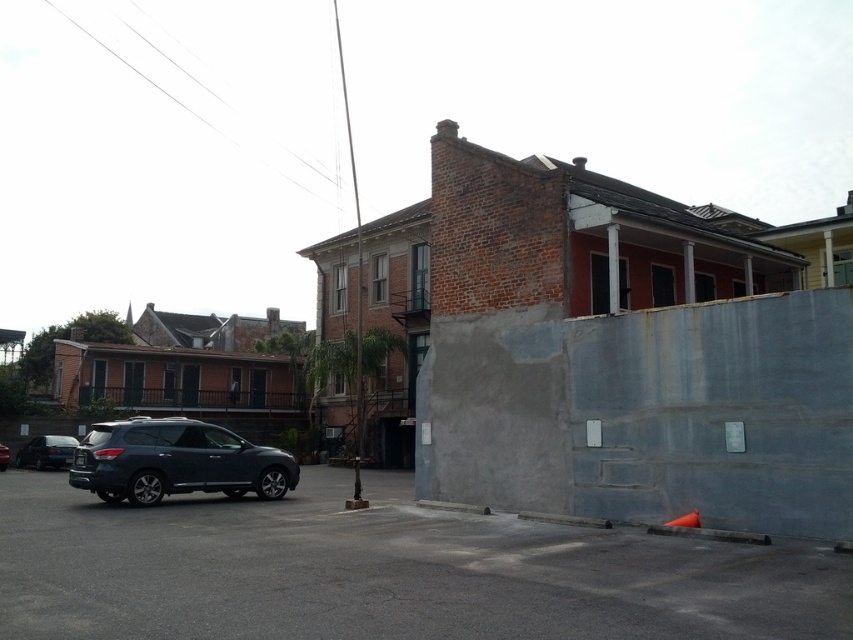
Looking at this image, does satin black suv at lower left have a smaller size compared to satin black sedan at lower left?

No, satin black suv at lower left is not smaller than satin black sedan at lower left.

At what (x,y) coordinates should I click in order to perform the action: click on satin black suv at lower left. Please return your answer as a coordinate pair (x, y). The height and width of the screenshot is (640, 853). Looking at the image, I should click on (177, 461).

Describe the element at coordinates (177, 461) in the screenshot. I see `satin black suv at lower left` at that location.

The width and height of the screenshot is (853, 640). Identify the location of satin black suv at lower left. (177, 461).

Looking at this image, can you confirm if satin black sedan at lower left is positioned to the left of matte black suv at lower left?

No, satin black sedan at lower left is not to the left of matte black suv at lower left.

Is point (54, 440) closer to viewer compared to point (4, 460)?

No.

Find the location of `satin black sedan at lower left`. satin black sedan at lower left is located at coordinates (45, 451).

Who is positioned more to the right, satin black suv at lower left or matte black suv at lower left?

From the viewer's perspective, satin black suv at lower left appears more on the right side.

Is point (245, 449) positioned before point (3, 468)?

Yes, point (245, 449) is closer to viewer.

Who is more forward, (79,467) or (0,458)?

Point (79,467) is more forward.

Locate an element on the screen. The image size is (853, 640). satin black suv at lower left is located at coordinates [177, 461].